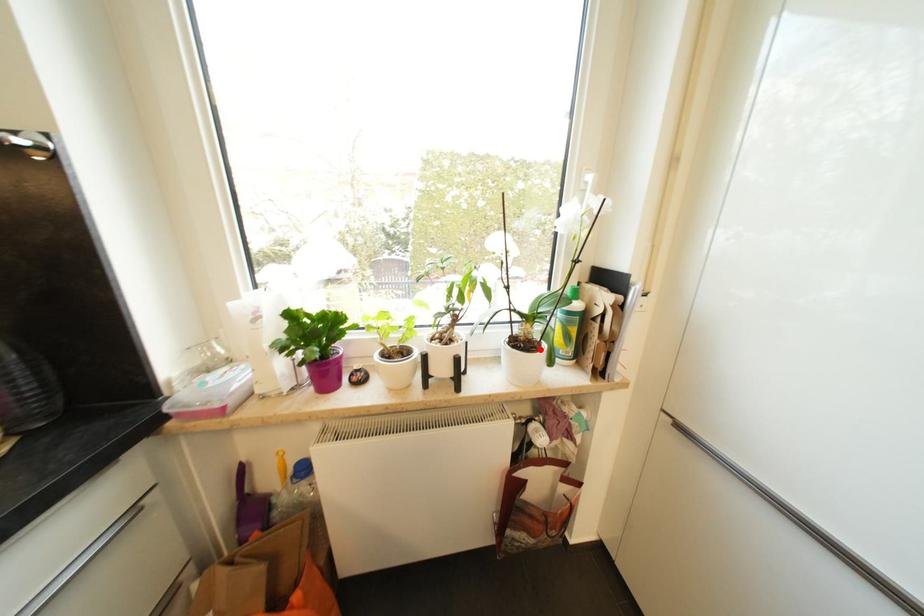
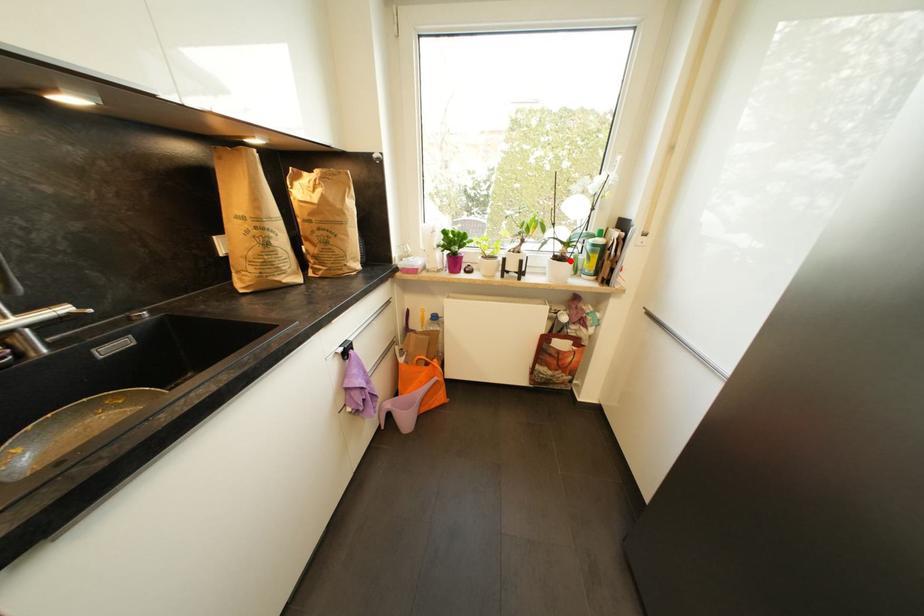
I am providing you with two images of the same scene from different viewpoints. A red point is marked on the first image and another point is marked on the second image. Do the highlighted points in image1 and image2 indicate the same real-world spot?

Yes